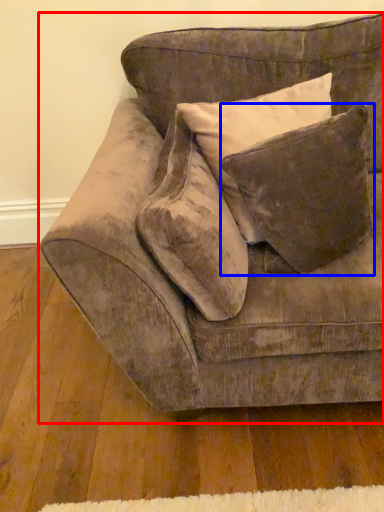
Question: Which of the following is the closest to the observer, studio couch (highlighted by a red box) or pillow (highlighted by a blue box)?

Choices:
 (A) studio couch
 (B) pillow

Answer: (A)